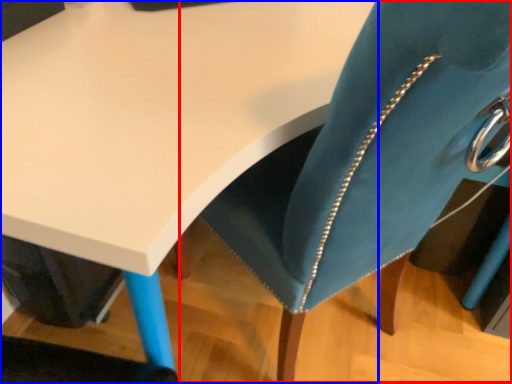
Question: Among these objects, which one is farthest to the camera, swivel chair (highlighted by a red box) or table (highlighted by a blue box)?

Choices:
 (A) swivel chair
 (B) table

Answer: (B)